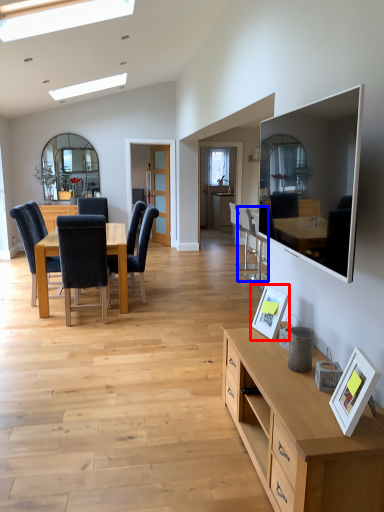
Question: Which object is closer to the camera taking this photo, picture frame (highlighted by a red box) or chair (highlighted by a blue box)?

Choices:
 (A) picture frame
 (B) chair

Answer: (A)